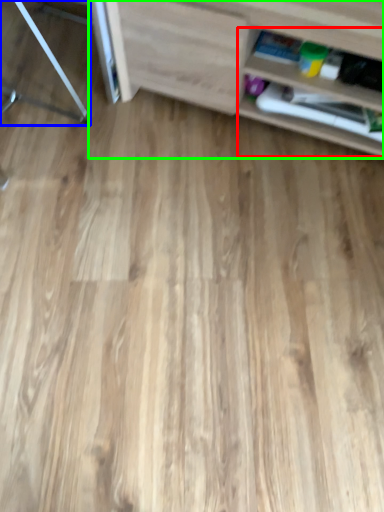
Question: Which object is positioned closest to shelf (highlighted by a red box)? Select from furniture (highlighted by a blue box) and shelf (highlighted by a green box).

Choices:
 (A) furniture
 (B) shelf

Answer: (B)